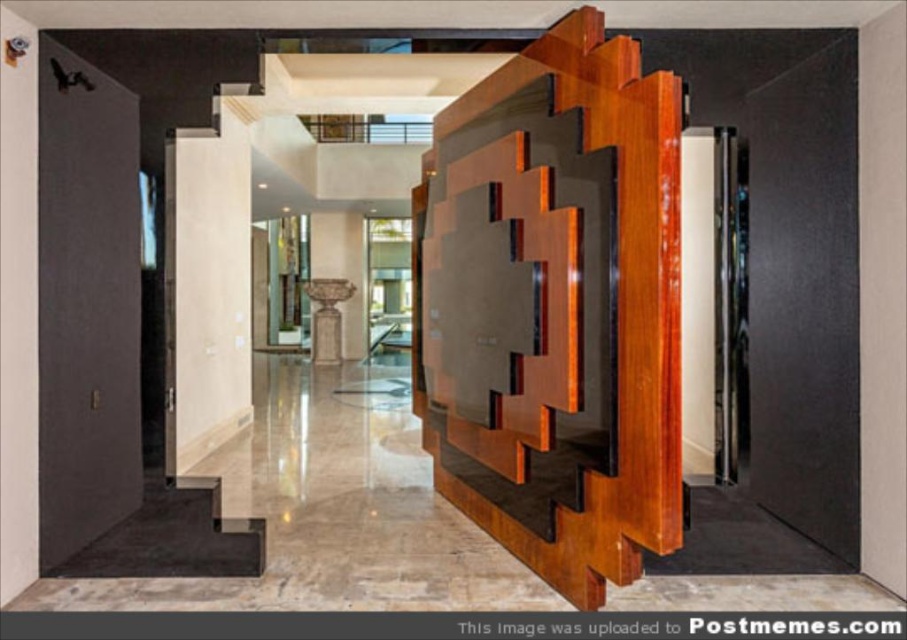
Is shiny brown wood at center thinner than matte black door at left?

No.

Where is `shiny brown wood at center`? This screenshot has width=907, height=640. shiny brown wood at center is located at coordinates (556, 307).

Based on the photo, does shiny brown wood at center have a larger size compared to light wood door at center?

Indeed, shiny brown wood at center has a larger size compared to light wood door at center.

I want to click on shiny brown wood at center, so click(556, 307).

Does matte black door at left have a lesser height compared to light wood door at center?

No.

Is point (93, 394) positioned before point (171, 186)?

Yes, it is.

Image resolution: width=907 pixels, height=640 pixels. I want to click on matte black door at left, so click(86, 301).